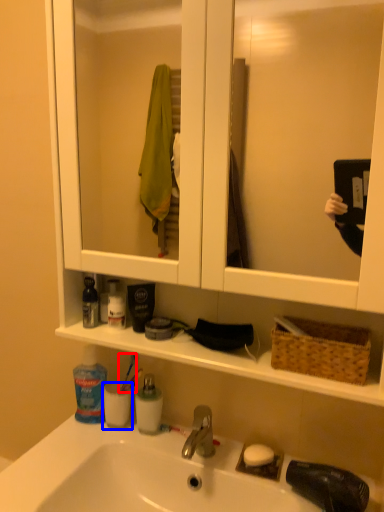
Question: Which point is further to the camera, toothbrush (highlighted by a red box) or mouthwash (highlighted by a blue box)?

Choices:
 (A) toothbrush
 (B) mouthwash

Answer: (A)